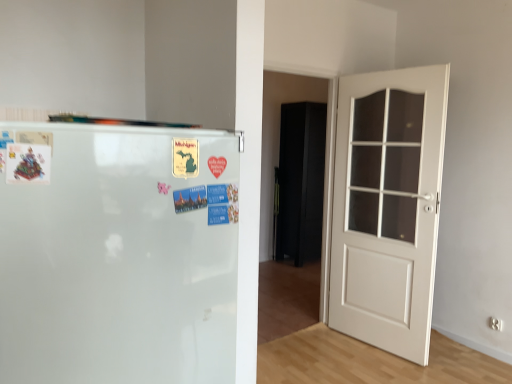
Identify the location of free point to the left of white wooden door at right. This screenshot has height=384, width=512. (323, 352).